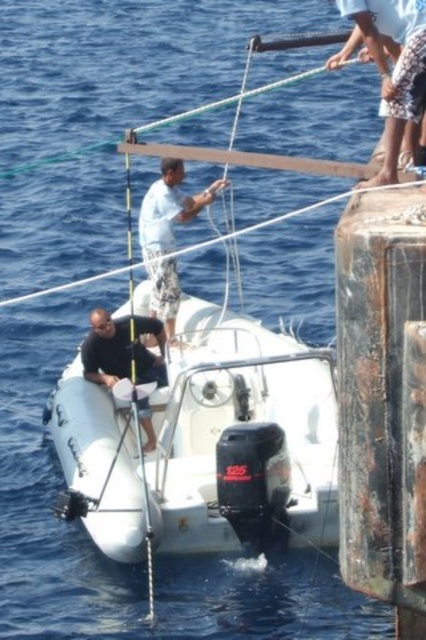
You are a sailor on the boat and need to retrieve an item from the white cotton shirt at center. Which direction should you move relative to the white rubber dinghy at center?

The white rubber dinghy at center is to the right of the white cotton shirt at center, so you should move to the left relative to the white rubber dinghy at center to reach the white cotton shirt at center.